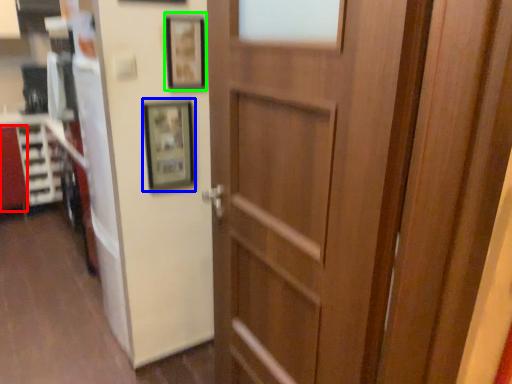
Question: Based on their relative distances, which object is farther from cabinetry (highlighted by a red box)? Choose from picture frame (highlighted by a blue box) and picture frame (highlighted by a green box).

Choices:
 (A) picture frame
 (B) picture frame

Answer: (B)